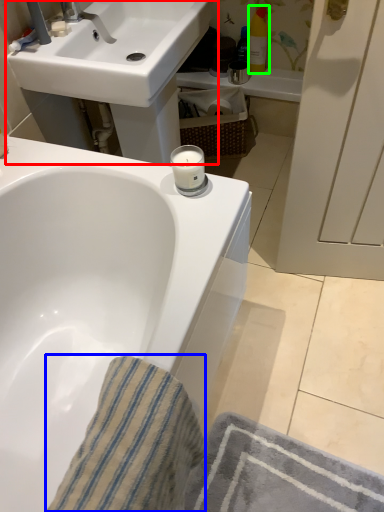
Question: Based on their relative distances, which object is farther from sink (highlighted by a red box)? Choose from bath towel (highlighted by a blue box) and toiletry (highlighted by a green box).

Choices:
 (A) bath towel
 (B) toiletry

Answer: (A)